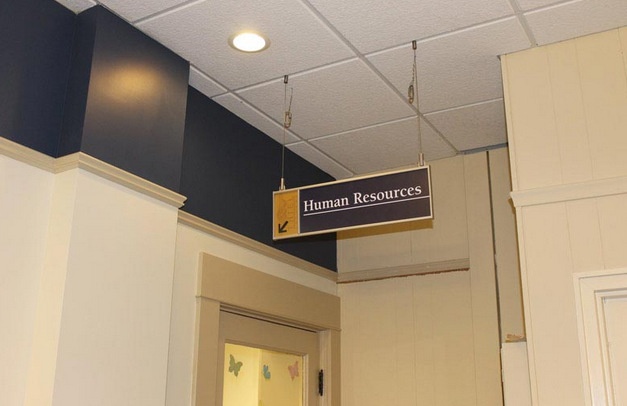
The width and height of the screenshot is (627, 406). In order to click on white wood paneling in this screenshot , I will do `click(537, 124)`, `click(566, 123)`, `click(609, 118)`, `click(571, 245)`, `click(603, 239)`.